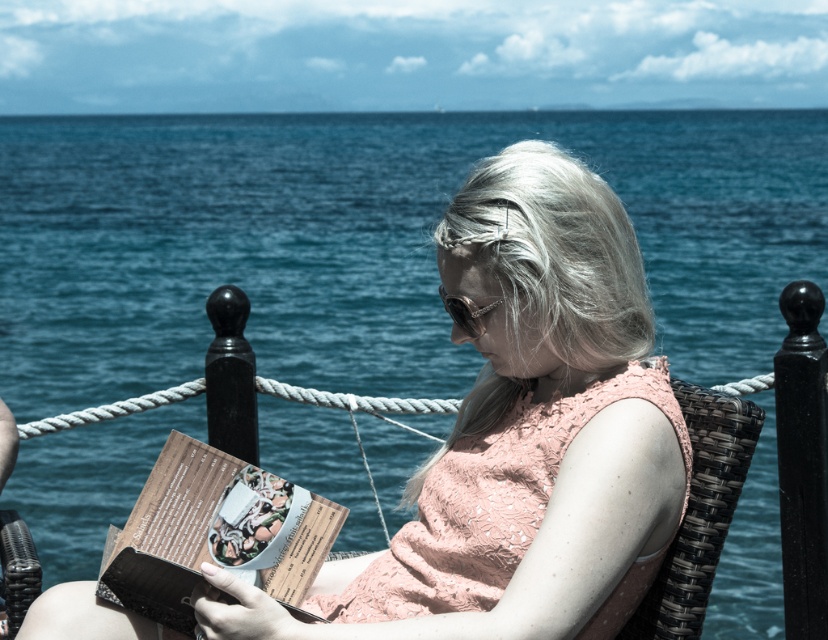
Based on the photo, you are a photographer standing at the camera position. You want to take a closeup photo of the matte brown book at center. Can you reach it without moving from your current position?

The matte brown book at center is 3.33 meters away from camera. Since the average arm length is about 0.7 meters, you cannot reach it without moving closer.